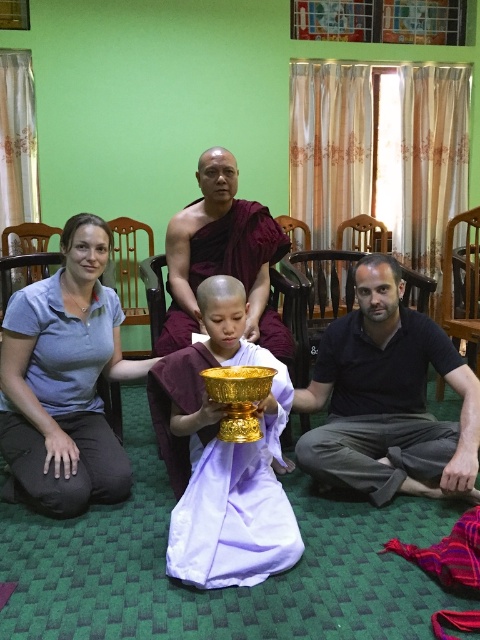
You are a photographer setting up for a group photo. The scene includes a dark blue shirt at center and a matte gold bowl at center. To ensure both are visible, you need to adjust the camera angle. Which object should you prioritize framing closer to the center to accommodate its size?

The dark blue shirt at center might be wider than matte gold bowl at center, so you should prioritize framing the dark blue shirt at center closer to the center to accommodate its size.

Please look at the image and locate the point with coordinates (199,220). What object is located at this point?

The point at coordinates (199,220) indicates the location of the matte gold bowl at center.